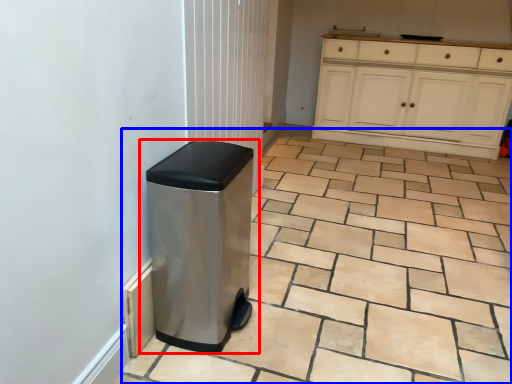
Question: Which point is closer to the camera, waste container (highlighted by a red box) or ceramic tile (highlighted by a blue box)?

Choices:
 (A) waste container
 (B) ceramic tile

Answer: (B)